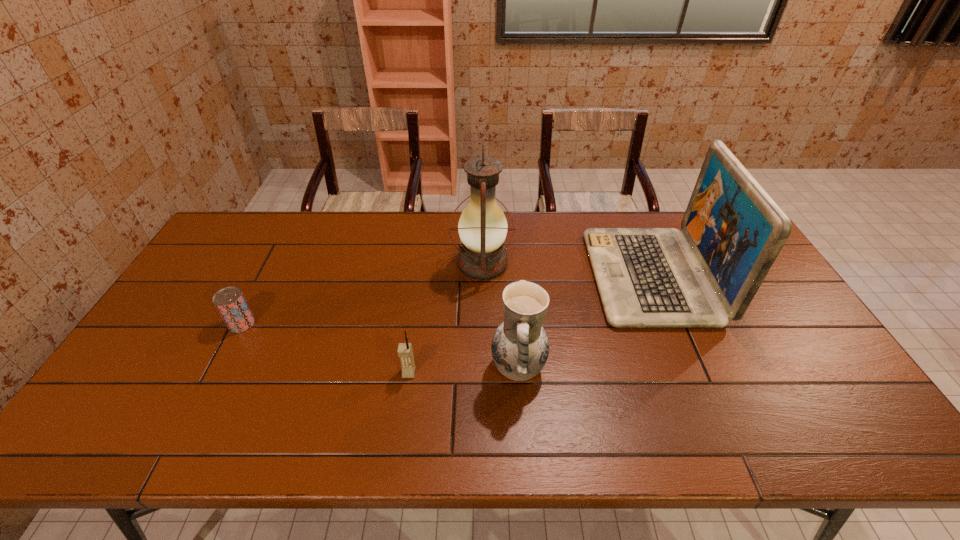
This screenshot has height=540, width=960. I want to click on vacant space located 0.180m on the screen of the fourth shortest object, so (536, 276).

Locate an element on the screen. This screenshot has height=540, width=960. vacant space situated 0.320m on the screen of the fourth shortest object is located at coordinates (492, 276).

Identify the location of free region located on either side of the pottery. (354, 368).

You are a GUI agent. You are given a task and a screenshot of the screen. Output one action in this format:
    pyautogui.click(x=<x>, y=<y>)
    Task: Click on the free space located 0.110m on either side of the pottery
    
    Given the screenshot: What is the action you would take?
    pyautogui.click(x=448, y=368)

In order to click on vacant space situated 0.190m on either side of the pottery in this screenshot , I will do `click(417, 368)`.

The width and height of the screenshot is (960, 540). Identify the location of vacant area situated 0.170m on the front of the cellular telephone, where the keypad is located. (399, 443).

Where is `free space located on the back of the shortest object`? free space located on the back of the shortest object is located at coordinates (262, 285).

The width and height of the screenshot is (960, 540). Identify the location of oil lamp at the far edge. (482, 227).

Find the location of a particular element. The width and height of the screenshot is (960, 540). laptop computer present at the far edge is located at coordinates coord(647,277).

I want to click on vacant area at the far edge, so click(x=557, y=212).